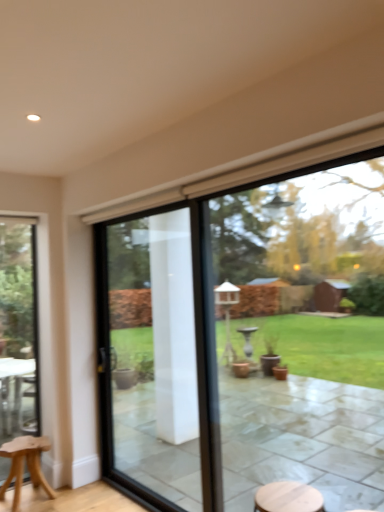
Question: Can you confirm if light brown wooden stool at lower left is positioned to the left of clear glass door at center?

Choices:
 (A) yes
 (B) no

Answer: (A)

Question: Is light brown wooden stool at lower left to the right of clear glass door at center from the viewer's perspective?

Choices:
 (A) yes
 (B) no

Answer: (B)

Question: From the image's perspective, does light brown wooden stool at lower left appear lower than clear glass door at center?

Choices:
 (A) no
 (B) yes

Answer: (B)

Question: Does light brown wooden stool at lower left have a lesser height compared to clear glass door at center?

Choices:
 (A) yes
 (B) no

Answer: (A)

Question: Is light brown wooden stool at lower left aimed at clear glass door at center?

Choices:
 (A) no
 (B) yes

Answer: (A)

Question: From the image's perspective, is clear glass door at center above or below light brown wooden stool at lower left?

Choices:
 (A) above
 (B) below

Answer: (A)

Question: Would you say clear glass door at center is to the left or to the right of light brown wooden stool at lower left in the picture?

Choices:
 (A) right
 (B) left

Answer: (A)

Question: Relative to light brown wooden stool at lower left, is clear glass door at center in front or behind?

Choices:
 (A) behind
 (B) front

Answer: (B)

Question: Looking at their shapes, would you say clear glass door at center is wider or thinner than light brown wooden stool at lower left?

Choices:
 (A) wide
 (B) thin

Answer: (B)

Question: From the image's perspective, is clear glass door at center above or below clear glass door at left, arranged as the 2th window when viewed from the front?

Choices:
 (A) below
 (B) above

Answer: (B)

Question: Is clear glass door at center taller or shorter than clear glass door at left, arranged as the 2th window when viewed from the front?

Choices:
 (A) tall
 (B) short

Answer: (B)

Question: Is clear glass door at center bigger or smaller than clear glass door at left, the 1th window when ordered from left to right?

Choices:
 (A) big
 (B) small

Answer: (A)

Question: Considering the positions of clear glass door at center and clear glass door at left, acting as the first window starting from the back, in the image, is clear glass door at center wider or thinner than clear glass door at left, acting as the first window starting from the back,?

Choices:
 (A) wide
 (B) thin

Answer: (A)

Question: Considering the positions of clear glass door at left, arranged as the 2th window when viewed from the front, and transparent glass window at center, the 2th window in the left-to-right sequence, in the image, is clear glass door at left, arranged as the 2th window when viewed from the front, bigger or smaller than transparent glass window at center, the 2th window in the left-to-right sequence,?

Choices:
 (A) big
 (B) small

Answer: (B)

Question: From their relative heights in the image, would you say clear glass door at left, the 1th window when ordered from left to right, is taller or shorter than transparent glass window at center, the first window when ordered from right to left?

Choices:
 (A) short
 (B) tall

Answer: (B)